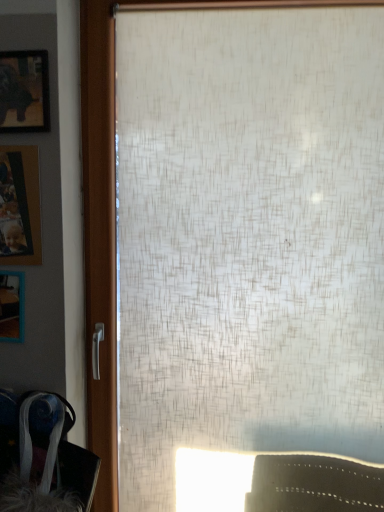
This screenshot has height=512, width=384. What do you see at coordinates (24, 91) in the screenshot?
I see `matte black picture frame at upper left, which ranks as the 1th picture frame in top-to-bottom order` at bounding box center [24, 91].

This screenshot has height=512, width=384. In order to click on velvet-like fabric swivel chair at lower left in this screenshot , I will do click(42, 457).

Considering the positions of objects wooden photo frame at left, placed as the 2th picture frame when sorted from top to bottom, and wooden frame at left, which is counted as the 1th picture frame, starting from the bottom, in the image provided, who is in front, wooden photo frame at left, placed as the 2th picture frame when sorted from top to bottom, or wooden frame at left, which is counted as the 1th picture frame, starting from the bottom,?

wooden photo frame at left, placed as the 2th picture frame when sorted from top to bottom, is closer to the camera.

Would you say wooden photo frame at left, which is the second picture frame in bottom-to-top order, is to the left or to the right of wooden frame at left, positioned as the third picture frame in top-to-bottom order, in the picture?

From the image, it's evident that wooden photo frame at left, which is the second picture frame in bottom-to-top order, is to the right of wooden frame at left, positioned as the third picture frame in top-to-bottom order.

Identify the location of picture frame that is the 1st one above the wooden frame at left, which is counted as the 1th picture frame, starting from the bottom (from a real-world perspective). This screenshot has width=384, height=512. (19, 206).

Who is shorter, wooden photo frame at left, which is the second picture frame in bottom-to-top order, or wooden frame at left, which is counted as the 1th picture frame, starting from the bottom?

wooden frame at left, which is counted as the 1th picture frame, starting from the bottom, is shorter.

You are a GUI agent. You are given a task and a screenshot of the screen. Output one action in this format:
    pyautogui.click(x=<x>, y=<y>)
    Task: Click on the 2nd picture frame directly above the wooden frame at left, positioned as the third picture frame in top-to-bottom order (from a real-world perspective)
    The height and width of the screenshot is (512, 384).
    Given the screenshot: What is the action you would take?
    pyautogui.click(x=24, y=91)

Which is less distant, (44, 99) or (7, 289)?

Point (44, 99) appears to be closer to the viewer than point (7, 289).

Can you confirm if matte black picture frame at upper left, positioned as the third picture frame in bottom-to-top order, is smaller than wooden frame at left, positioned as the third picture frame in top-to-bottom order?

Indeed, matte black picture frame at upper left, positioned as the third picture frame in bottom-to-top order, has a smaller size compared to wooden frame at left, positioned as the third picture frame in top-to-bottom order.

Is matte black picture frame at upper left, which ranks as the 1th picture frame in top-to-bottom order, looking in the opposite direction of wooden frame at left, positioned as the third picture frame in top-to-bottom order?

No, matte black picture frame at upper left, which ranks as the 1th picture frame in top-to-bottom order, is not facing the opposite direction of wooden frame at left, positioned as the third picture frame in top-to-bottom order.

Between wooden photo frame at left, which is the second picture frame in bottom-to-top order, and velvet-like fabric swivel chair at lower left, which one has less height?

wooden photo frame at left, which is the second picture frame in bottom-to-top order, is shorter.

From the image's perspective, which object appears higher, wooden photo frame at left, which is the second picture frame in bottom-to-top order, or velvet-like fabric swivel chair at lower left?

wooden photo frame at left, which is the second picture frame in bottom-to-top order, is shown above in the image.

In terms of width, does wooden photo frame at left, which is the second picture frame in bottom-to-top order, look wider or thinner when compared to velvet-like fabric swivel chair at lower left?

wooden photo frame at left, which is the second picture frame in bottom-to-top order, is thinner than velvet-like fabric swivel chair at lower left.

In terms of height, does wooden frame at left, which is counted as the 1th picture frame, starting from the bottom, look taller or shorter compared to matte black picture frame at upper left, positioned as the third picture frame in bottom-to-top order?

wooden frame at left, which is counted as the 1th picture frame, starting from the bottom, is shorter than matte black picture frame at upper left, positioned as the third picture frame in bottom-to-top order.

Which of these two, wooden frame at left, positioned as the third picture frame in top-to-bottom order, or matte black picture frame at upper left, positioned as the third picture frame in bottom-to-top order, is thinner?

matte black picture frame at upper left, positioned as the third picture frame in bottom-to-top order, is thinner.

Are wooden frame at left, which is counted as the 1th picture frame, starting from the bottom, and matte black picture frame at upper left, positioned as the third picture frame in bottom-to-top order, beside each other?

No.

Who is smaller, wooden frame at left, positioned as the third picture frame in top-to-bottom order, or matte black picture frame at upper left, which ranks as the 1th picture frame in top-to-bottom order?

With smaller size is matte black picture frame at upper left, which ranks as the 1th picture frame in top-to-bottom order.

Which object is positioned more to the right, wooden photo frame at left, placed as the 2th picture frame when sorted from top to bottom, or matte black picture frame at upper left, which ranks as the 1th picture frame in top-to-bottom order?

matte black picture frame at upper left, which ranks as the 1th picture frame in top-to-bottom order.

How many degrees apart are the facing directions of wooden photo frame at left, which is the second picture frame in bottom-to-top order, and matte black picture frame at upper left, which ranks as the 1th picture frame in top-to-bottom order?

The angle between the facing direction of wooden photo frame at left, which is the second picture frame in bottom-to-top order, and the facing direction of matte black picture frame at upper left, which ranks as the 1th picture frame in top-to-bottom order, is 0.0179 degrees.

Can you confirm if wooden photo frame at left, placed as the 2th picture frame when sorted from top to bottom, is bigger than matte black picture frame at upper left, which ranks as the 1th picture frame in top-to-bottom order?

Yes.

Locate an element on the screen. This screenshot has height=512, width=384. picture frame that is the 1st object located below the matte black picture frame at upper left, which ranks as the 1th picture frame in top-to-bottom order (from the image's perspective) is located at coordinates (19, 206).

Between wooden frame at left, which is counted as the 1th picture frame, starting from the bottom, and velvet-like fabric swivel chair at lower left, which one has larger size?

With larger size is velvet-like fabric swivel chair at lower left.

Does point (18, 328) appear closer or farther from the camera than point (56, 470)?

Point (18, 328) is positioned farther from the camera compared to point (56, 470).

Is wooden frame at left, positioned as the third picture frame in top-to-bottom order, oriented towards velvet-like fabric swivel chair at lower left?

No, wooden frame at left, positioned as the third picture frame in top-to-bottom order, is not facing towards velvet-like fabric swivel chair at lower left.

Does point (22, 70) come farther from viewer compared to point (47, 474)?

Yes, point (22, 70) is farther from viewer.

Considering the relative positions of matte black picture frame at upper left, positioned as the third picture frame in bottom-to-top order, and velvet-like fabric swivel chair at lower left in the image provided, is matte black picture frame at upper left, positioned as the third picture frame in bottom-to-top order, in front of velvet-like fabric swivel chair at lower left?

No, it is behind velvet-like fabric swivel chair at lower left.

From the image's perspective, is matte black picture frame at upper left, positioned as the third picture frame in bottom-to-top order, above or below velvet-like fabric swivel chair at lower left?

From the image's perspective, matte black picture frame at upper left, positioned as the third picture frame in bottom-to-top order, appears above velvet-like fabric swivel chair at lower left.

Identify the location of the 1st picture frame directly above the wooden frame at left, positioned as the third picture frame in top-to-bottom order (from a real-world perspective). The image size is (384, 512). (19, 206).

The width and height of the screenshot is (384, 512). I want to click on the 2nd picture frame counting from the left side of the matte black picture frame at upper left, positioned as the third picture frame in bottom-to-top order, so click(12, 306).

From the image, which object appears to be nearer to matte black picture frame at upper left, which ranks as the 1th picture frame in top-to-bottom order, velvet-like fabric swivel chair at lower left or wooden photo frame at left, placed as the 2th picture frame when sorted from top to bottom?

wooden photo frame at left, placed as the 2th picture frame when sorted from top to bottom, is positioned closer to the anchor matte black picture frame at upper left, which ranks as the 1th picture frame in top-to-bottom order.

Based on their spatial positions, is wooden photo frame at left, placed as the 2th picture frame when sorted from top to bottom, or wooden frame at left, positioned as the third picture frame in top-to-bottom order, closer to matte black picture frame at upper left, which ranks as the 1th picture frame in top-to-bottom order?

Among the two, wooden photo frame at left, placed as the 2th picture frame when sorted from top to bottom, is located nearer to matte black picture frame at upper left, which ranks as the 1th picture frame in top-to-bottom order.

Considering their positions, is wooden photo frame at left, placed as the 2th picture frame when sorted from top to bottom, positioned closer to wooden frame at left, positioned as the third picture frame in top-to-bottom order, than matte black picture frame at upper left, positioned as the third picture frame in bottom-to-top order?

wooden photo frame at left, placed as the 2th picture frame when sorted from top to bottom, lies closer to wooden frame at left, positioned as the third picture frame in top-to-bottom order, than the other object.

Based on their spatial positions, is wooden photo frame at left, which is the second picture frame in bottom-to-top order, or velvet-like fabric swivel chair at lower left further from wooden frame at left, which is counted as the 1th picture frame, starting from the bottom?

velvet-like fabric swivel chair at lower left lies further to wooden frame at left, which is counted as the 1th picture frame, starting from the bottom, than the other object.

Considering their positions, is wooden frame at left, positioned as the third picture frame in top-to-bottom order, positioned further to wooden photo frame at left, placed as the 2th picture frame when sorted from top to bottom, than matte black picture frame at upper left, positioned as the third picture frame in bottom-to-top order?

Based on the image, matte black picture frame at upper left, positioned as the third picture frame in bottom-to-top order, appears to be further to wooden photo frame at left, placed as the 2th picture frame when sorted from top to bottom.

Which object lies nearer to the anchor point matte black picture frame at upper left, positioned as the third picture frame in bottom-to-top order, wooden frame at left, which is counted as the 1th picture frame, starting from the bottom, or wooden photo frame at left, which is the second picture frame in bottom-to-top order?

wooden photo frame at left, which is the second picture frame in bottom-to-top order.

Considering their positions, is velvet-like fabric swivel chair at lower left positioned closer to wooden frame at left, positioned as the third picture frame in top-to-bottom order, than matte black picture frame at upper left, which ranks as the 1th picture frame in top-to-bottom order?

Based on the image, velvet-like fabric swivel chair at lower left appears to be nearer to wooden frame at left, positioned as the third picture frame in top-to-bottom order.

From the image, which object appears to be nearer to matte black picture frame at upper left, which ranks as the 1th picture frame in top-to-bottom order, wooden frame at left, which is counted as the 1th picture frame, starting from the bottom, or velvet-like fabric swivel chair at lower left?

wooden frame at left, which is counted as the 1th picture frame, starting from the bottom, is positioned closer to the anchor matte black picture frame at upper left, which ranks as the 1th picture frame in top-to-bottom order.

The image size is (384, 512). Find the location of `picture frame that lies between wooden photo frame at left, placed as the 2th picture frame when sorted from top to bottom, and velvet-like fabric swivel chair at lower left from top to bottom`. picture frame that lies between wooden photo frame at left, placed as the 2th picture frame when sorted from top to bottom, and velvet-like fabric swivel chair at lower left from top to bottom is located at coordinates (12, 306).

Find the location of a particular element. The width and height of the screenshot is (384, 512). picture frame between matte black picture frame at upper left, positioned as the third picture frame in bottom-to-top order, and wooden frame at left, which is counted as the 1th picture frame, starting from the bottom, in the vertical direction is located at coordinates (19, 206).